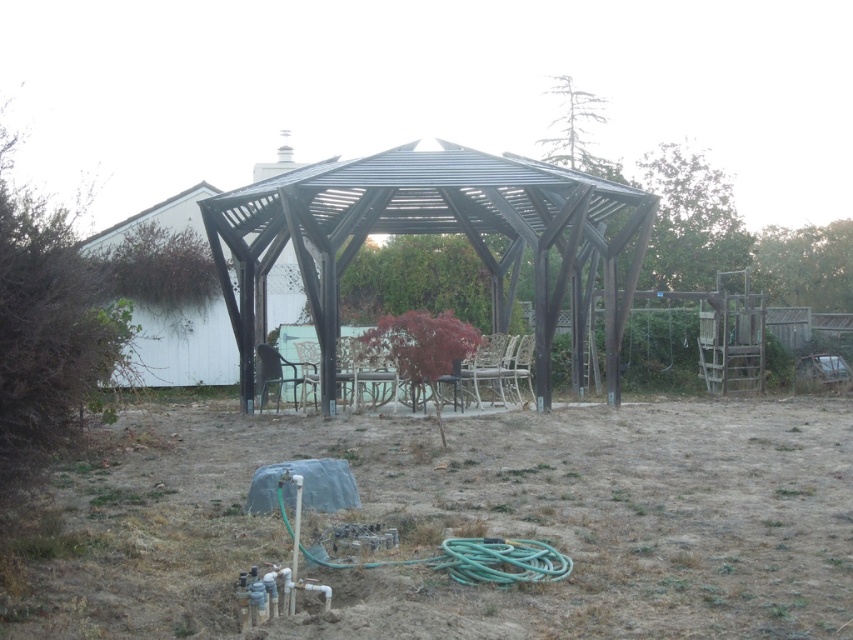
You are a gardener who wants to water the brown dry soil at center using the green rubber garden hose at lower center. Can you reach the soil with the hose from its current position?

The brown dry soil at center is bigger than the green rubber garden hose at lower center, but the question of reachability isn not addressed in the description. Therefore, based on the provided information, it is unclear if the green rubber garden hose at lower center can reach the brown dry soil at center.